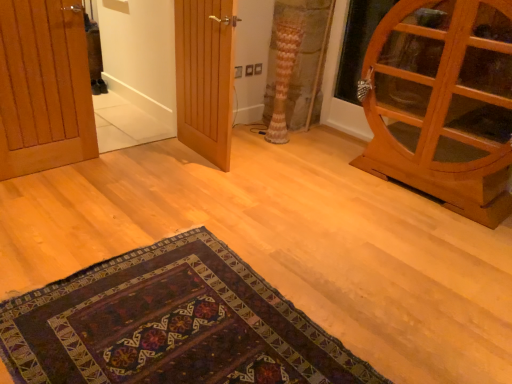
Locate an element on the screen. Image resolution: width=512 pixels, height=384 pixels. vacant area located to the right-hand side of wooden door at left, placed as the third door when sorted from right to left is located at coordinates (102, 178).